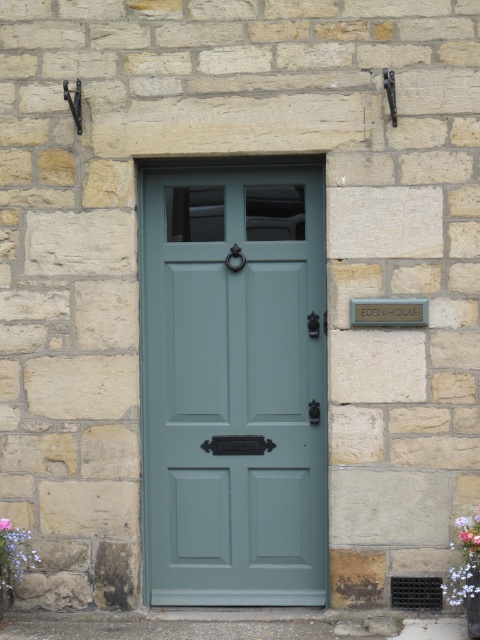
The height and width of the screenshot is (640, 480). What do you see at coordinates (233, 385) in the screenshot?
I see `satin green door at center` at bounding box center [233, 385].

Identify the location of satin green door at center. This screenshot has width=480, height=640. (233, 385).

Is satin green door at center below purple matte flower at lower left?

No.

Can you confirm if satin green door at center is shorter than purple matte flower at lower left?

In fact, satin green door at center may be taller than purple matte flower at lower left.

Where is `satin green door at center`? The height and width of the screenshot is (640, 480). satin green door at center is located at coordinates (233, 385).

This screenshot has width=480, height=640. Find the location of `satin green door at center`. satin green door at center is located at coordinates (233, 385).

Does purple floral bouquet at lower right appear on the right side of purple matte flower at lower left?

Indeed, purple floral bouquet at lower right is positioned on the right side of purple matte flower at lower left.

Locate an element on the screen. This screenshot has height=640, width=480. purple floral bouquet at lower right is located at coordinates (465, 563).